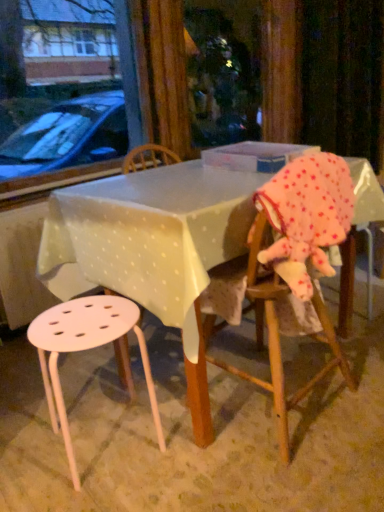
The image size is (384, 512). Find the location of `vacant region to the left of wooden chair at right`. vacant region to the left of wooden chair at right is located at coordinates (159, 409).